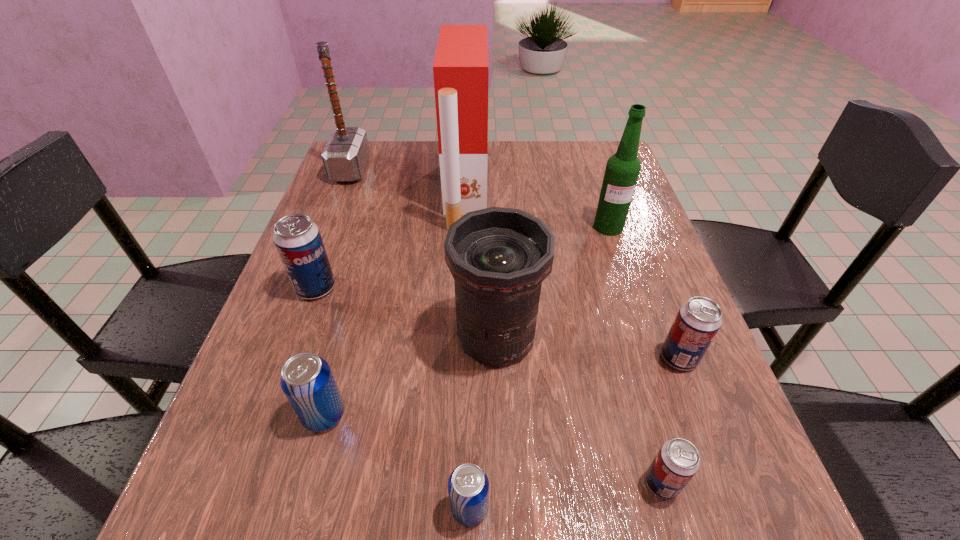
Image resolution: width=960 pixels, height=540 pixels. I want to click on free space located on the right of the second beer can from left to right, so click(x=401, y=415).

Image resolution: width=960 pixels, height=540 pixels. In order to click on vacant space situated 0.070m on the left of the fourth beer can from left to right in this screenshot , I will do `click(596, 483)`.

Identify the location of vacant area located on the left of the third beer can from right to left. This screenshot has height=540, width=960. (263, 508).

Where is `cigarette case located at the far edge`? This screenshot has width=960, height=540. cigarette case located at the far edge is located at coordinates (461, 69).

Identify the location of hammer that is at the far edge. (345, 156).

Where is `hammer that is positioned at the left edge`? This screenshot has width=960, height=540. hammer that is positioned at the left edge is located at coordinates (345, 156).

The width and height of the screenshot is (960, 540). What are the coordinates of `beer bottle located at the right edge` in the screenshot? It's located at (622, 170).

Identify the location of object that is at the far left corner. (345, 156).

Where is `object at the near right corner`? The height and width of the screenshot is (540, 960). object at the near right corner is located at coordinates (678, 460).

The image size is (960, 540). Identify the location of free spot at the far edge of the desktop. (492, 142).